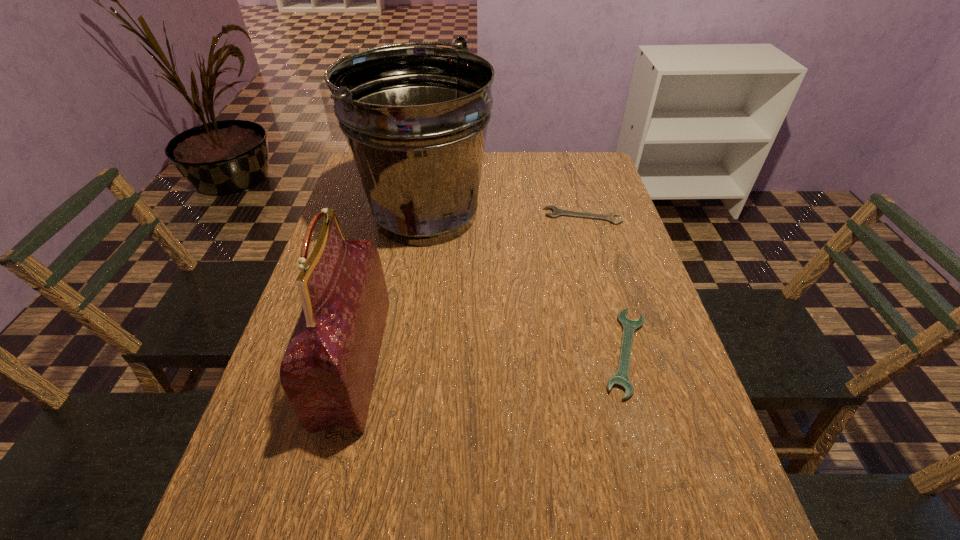
Locate an element on the screen. This screenshot has height=540, width=960. the tallest object is located at coordinates (415, 118).

Image resolution: width=960 pixels, height=540 pixels. What are the coordinates of `the second tallest object` in the screenshot? It's located at (328, 370).

I want to click on the nearer wrench, so click(x=621, y=380).

The height and width of the screenshot is (540, 960). What are the coordinates of `the farther wrench` in the screenshot? It's located at (556, 211).

Locate an element on the screen. free space located 0.120m on the front of the tallest object is located at coordinates (415, 289).

Locate an element on the screen. vacant space located 0.090m on the front-facing side of the handbag is located at coordinates (420, 362).

This screenshot has height=540, width=960. In order to click on vacant region located 0.080m on the back of the nearer wrench in this screenshot , I will do click(607, 288).

The image size is (960, 540). What are the coordinates of `vacant space located on the back of the farther wrench` in the screenshot? It's located at pyautogui.click(x=570, y=174).

Identify the location of object that is at the far edge. The width and height of the screenshot is (960, 540). (415, 118).

You are a GUI agent. You are given a task and a screenshot of the screen. Output one action in this format:
    pyautogui.click(x=<x>, y=<y>)
    Task: Click on the bucket that is positioned at the left edge
    This screenshot has width=960, height=540.
    Given the screenshot: What is the action you would take?
    pyautogui.click(x=415, y=118)